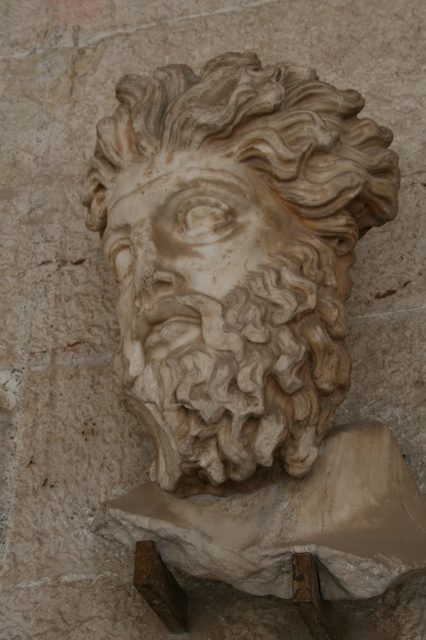
Does white marble lion at center come in front of white marble face at center?

Yes, it is.

Which is in front, point (310, 88) or point (135, 298)?

Point (135, 298) is more forward.

This screenshot has width=426, height=640. Find the location of `white marble lion at center`. white marble lion at center is located at coordinates (235, 259).